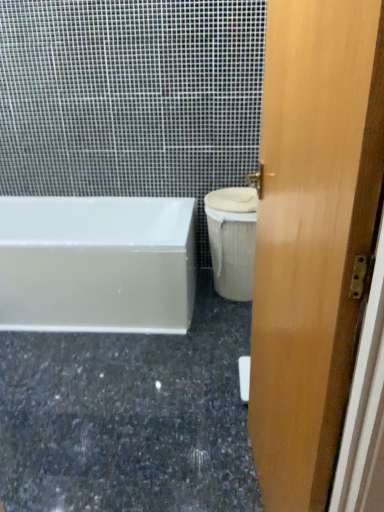
Question: Is white fabric-covered toilet bowl at right located outside light brown wood door at right?

Choices:
 (A) yes
 (B) no

Answer: (A)

Question: From the image's perspective, is white fabric-covered toilet bowl at right over light brown wood door at right?

Choices:
 (A) yes
 (B) no

Answer: (A)

Question: Considering the relative positions of white fabric-covered toilet bowl at right and light brown wood door at right in the image provided, is white fabric-covered toilet bowl at right to the left of light brown wood door at right from the viewer's perspective?

Choices:
 (A) yes
 (B) no

Answer: (A)

Question: Could you tell me if white fabric-covered toilet bowl at right is facing light brown wood door at right?

Choices:
 (A) no
 (B) yes

Answer: (B)

Question: Does white fabric-covered toilet bowl at right have a lesser height compared to light brown wood door at right?

Choices:
 (A) yes
 (B) no

Answer: (A)

Question: Which is correct: white glossy bathtub at left is inside granite at lower left, or outside of it?

Choices:
 (A) outside
 (B) inside

Answer: (A)

Question: Is white glossy bathtub at left bigger or smaller than granite at lower left?

Choices:
 (A) big
 (B) small

Answer: (A)

Question: Is white glossy bathtub at left wider or thinner than granite at lower left?

Choices:
 (A) thin
 (B) wide

Answer: (A)

Question: From the image's perspective, is white glossy bathtub at left positioned above or below granite at lower left?

Choices:
 (A) below
 (B) above

Answer: (B)

Question: In the image, is granite at lower left positioned in front of or behind white fabric-covered toilet bowl at right?

Choices:
 (A) front
 (B) behind

Answer: (A)

Question: From a real-world perspective, is granite at lower left positioned above or below white fabric-covered toilet bowl at right?

Choices:
 (A) below
 (B) above

Answer: (A)

Question: Considering the relative positions of granite at lower left and white fabric-covered toilet bowl at right in the image provided, is granite at lower left to the left or to the right of white fabric-covered toilet bowl at right?

Choices:
 (A) left
 (B) right

Answer: (A)

Question: From the image's perspective, is granite at lower left located above or below white fabric-covered toilet bowl at right?

Choices:
 (A) above
 (B) below

Answer: (B)

Question: Relative to white glossy bathtub at left, is white fabric-covered toilet bowl at right in front or behind?

Choices:
 (A) front
 (B) behind

Answer: (B)

Question: From a real-world perspective, is white fabric-covered toilet bowl at right physically located above or below white glossy bathtub at left?

Choices:
 (A) above
 (B) below

Answer: (A)